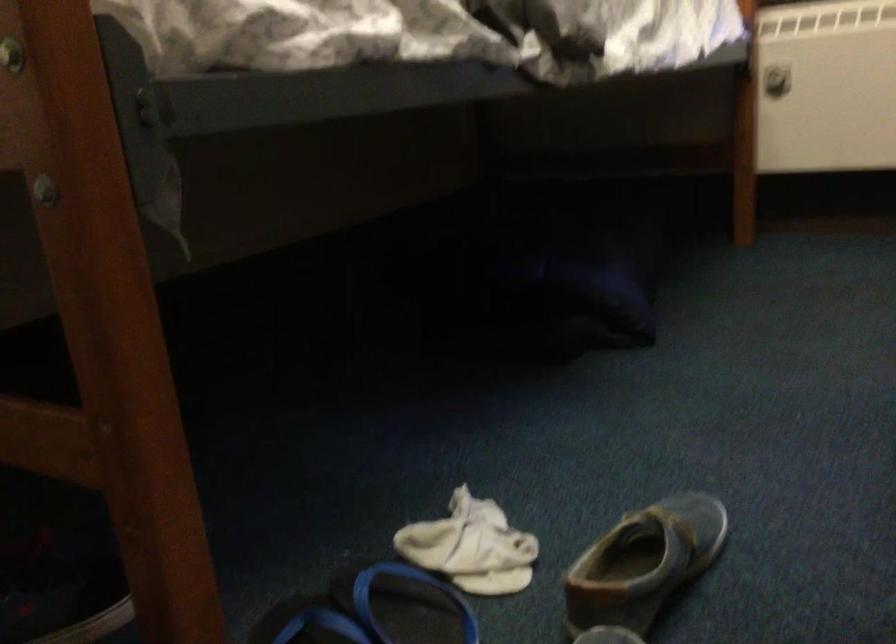
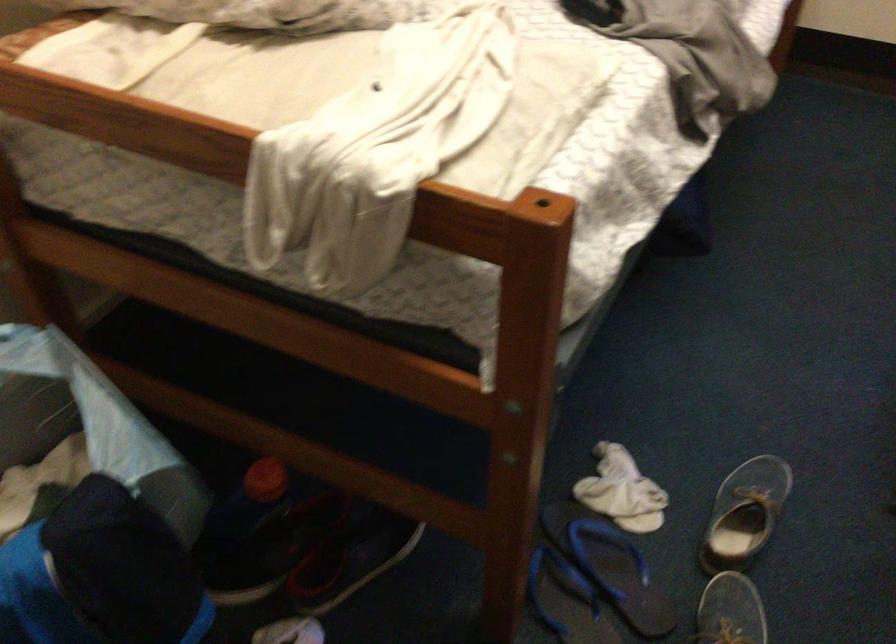
The point at (466, 543) is marked in the first image. Where is the corresponding point in the second image?

(622, 491)